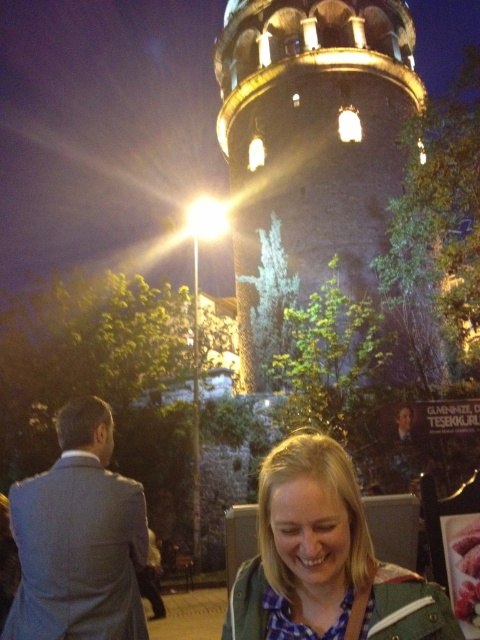
You are standing at the location of the blonde hair at lower center and want to take a photo of the stone tower at center. Considering the distance between them, would you need to zoom in your camera lens to capture the entire tower in the frame?

The stone tower at center is 37.35 meters away from the blonde hair at lower center. To capture the entire tower in the frame from that distance, you would likely need to use a wide angle lens or adjust your position to ensure the tower fits within the camera view. Zooming in might actually make it harder to include the whole structure, so a wide angle or repositioning is recommended.

Based on the scene description, where is the stone tower at center located in the image?

The stone tower at center is located at point (314, 129).